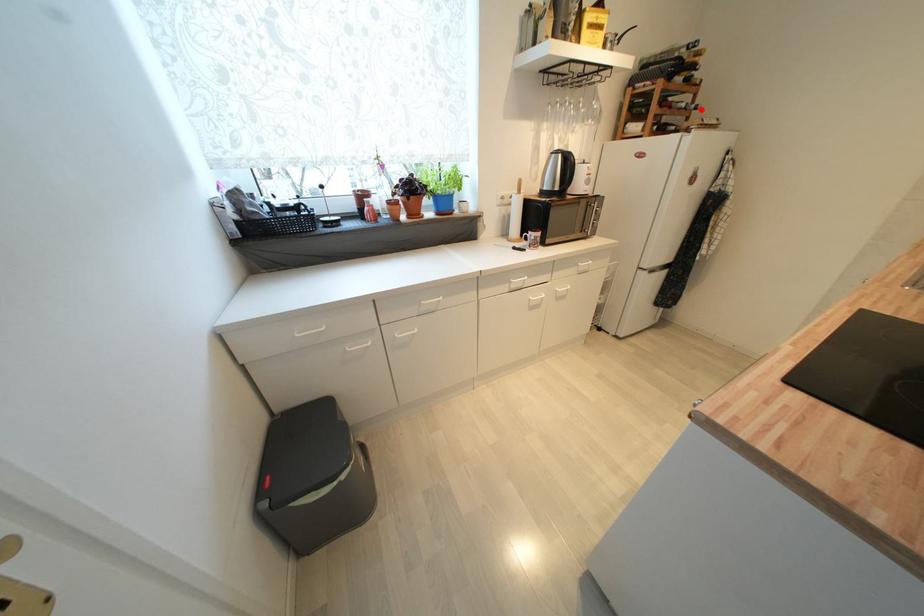
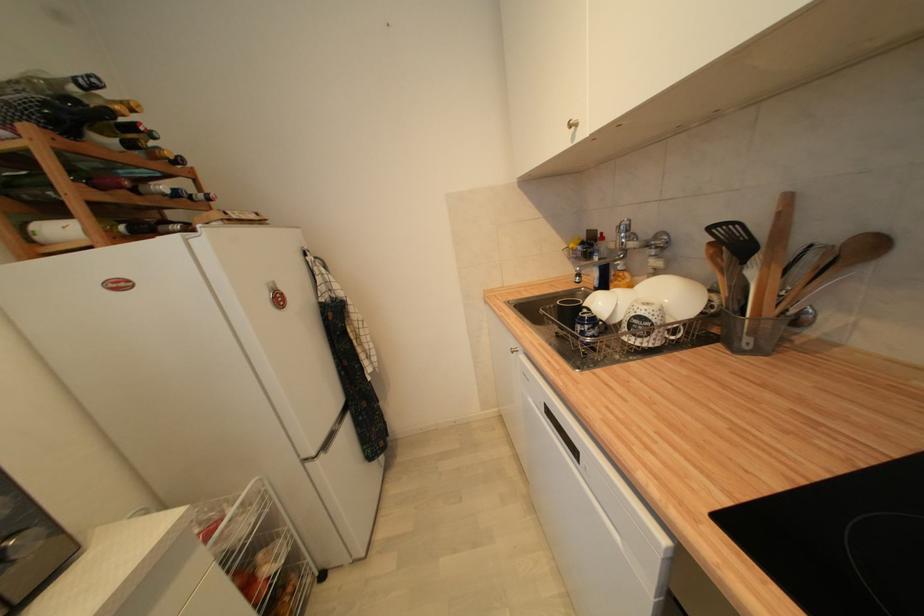
Find the pixel in the second image that matches the highlighted location in the first image.

(213, 200)